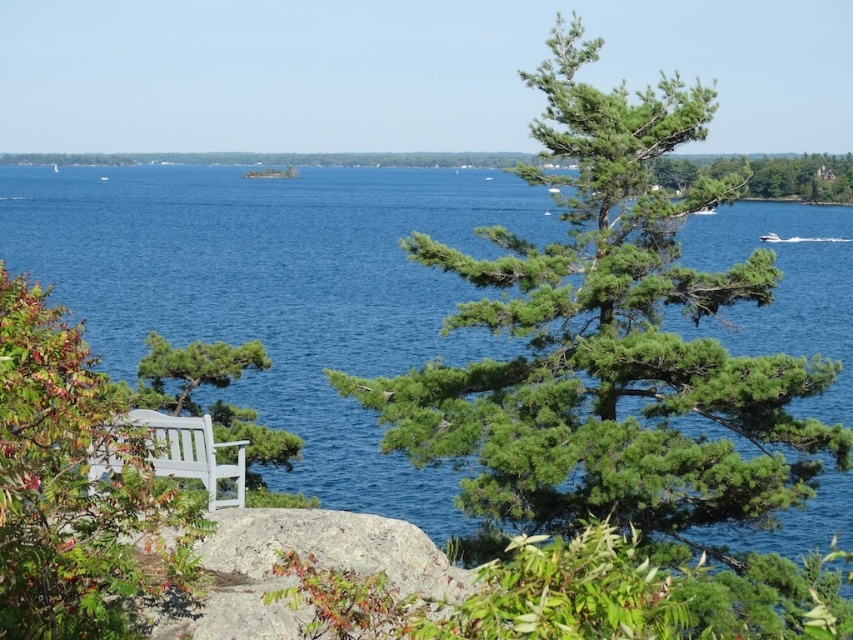
Between green needle-like tree at center and white painted wood bench at lower left, which one appears on the left side from the viewer's perspective?

From the viewer's perspective, white painted wood bench at lower left appears more on the left side.

This screenshot has height=640, width=853. What do you see at coordinates (608, 340) in the screenshot? I see `green needle-like tree at center` at bounding box center [608, 340].

What do you see at coordinates (608, 340) in the screenshot?
I see `green needle-like tree at center` at bounding box center [608, 340].

Image resolution: width=853 pixels, height=640 pixels. What are the coordinates of `green needle-like tree at center` in the screenshot? It's located at (608, 340).

Can you confirm if blue water at center is positioned to the left of white painted wood bench at lower left?

Incorrect, blue water at center is not on the left side of white painted wood bench at lower left.

Can you confirm if blue water at center is positioned to the right of white painted wood bench at lower left?

Indeed, blue water at center is positioned on the right side of white painted wood bench at lower left.

At what (x,y) coordinates should I click in order to perform the action: click on blue water at center. Please return your answer as a coordinate pair (x, y). The width and height of the screenshot is (853, 640). Looking at the image, I should click on pos(279,291).

Is green matte tree at lower left taller than white painted wood bench at lower left?

Indeed, green matte tree at lower left has a greater height compared to white painted wood bench at lower left.

Can you confirm if green matte tree at lower left is bigger than white painted wood bench at lower left?

Yes, green matte tree at lower left is bigger than white painted wood bench at lower left.

Identify the location of green matte tree at lower left. This screenshot has height=640, width=853. (77, 488).